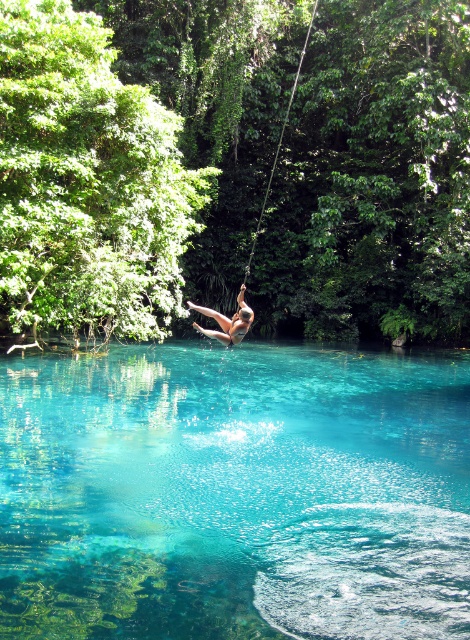
Can you confirm if transparent water at center is taller than smooth skin person at center?

In fact, transparent water at center may be shorter than smooth skin person at center.

Does transparent water at center appear on the right side of smooth skin person at center?

Correct, you'll find transparent water at center to the right of smooth skin person at center.

In order to click on transparent water at center in this screenshot , I will do `click(234, 493)`.

The height and width of the screenshot is (640, 470). In order to click on transparent water at center in this screenshot , I will do pos(234,493).